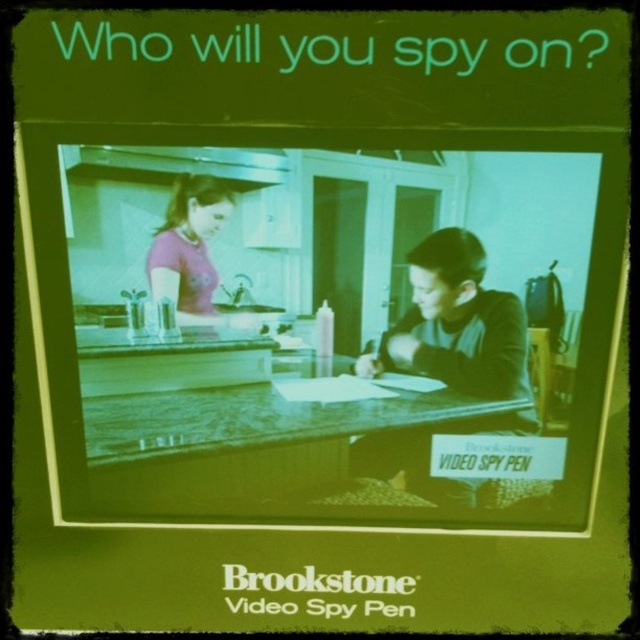
Is matte plastic counter top at center in front of matte purple shirt at upper left?

No.

Does matte plastic counter top at center appear on the right side of matte purple shirt at upper left?

Indeed, matte plastic counter top at center is positioned on the right side of matte purple shirt at upper left.

The width and height of the screenshot is (640, 640). Find the location of `matte plastic counter top at center`. matte plastic counter top at center is located at coordinates (260, 417).

What do you see at coordinates (456, 323) in the screenshot? I see `matte black shirt at center` at bounding box center [456, 323].

Which is behind, point (512, 428) or point (182, 246)?

The point (512, 428) is more distant.

The height and width of the screenshot is (640, 640). What do you see at coordinates (456, 323) in the screenshot?
I see `matte black shirt at center` at bounding box center [456, 323].

Where is `matte black shirt at center`? matte black shirt at center is located at coordinates (456, 323).

Can you confirm if matte plastic counter top at center is taller than matte black shirt at center?

Incorrect, matte plastic counter top at center's height is not larger of matte black shirt at center's.

Who is lower down, matte plastic counter top at center or matte black shirt at center?

matte plastic counter top at center is lower down.

Locate an element on the screen. matte plastic counter top at center is located at coordinates (260, 417).

At what (x,y) coordinates should I click in order to perform the action: click on matte plastic counter top at center. Please return your answer as a coordinate pair (x, y). The width and height of the screenshot is (640, 640). Looking at the image, I should click on (260, 417).